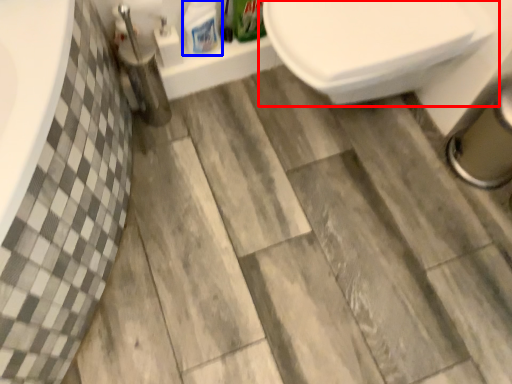
Question: Which object is further to the camera taking this photo, toilet (highlighted by a red box) or cleaning product (highlighted by a blue box)?

Choices:
 (A) toilet
 (B) cleaning product

Answer: (B)